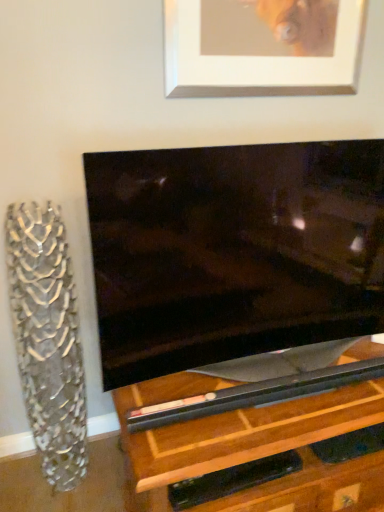
Question: Does silver/metallic picture frame at upper center have a lesser height compared to clear glass vase at left?

Choices:
 (A) yes
 (B) no

Answer: (A)

Question: Does silver/metallic picture frame at upper center have a greater height compared to clear glass vase at left?

Choices:
 (A) no
 (B) yes

Answer: (A)

Question: From the image's perspective, is silver/metallic picture frame at upper center on clear glass vase at left?

Choices:
 (A) yes
 (B) no

Answer: (A)

Question: Does silver/metallic picture frame at upper center have a lesser width compared to clear glass vase at left?

Choices:
 (A) no
 (B) yes

Answer: (B)

Question: Does silver/metallic picture frame at upper center appear on the right side of clear glass vase at left?

Choices:
 (A) no
 (B) yes

Answer: (B)

Question: Is silver/metallic picture frame at upper center looking in the opposite direction of clear glass vase at left?

Choices:
 (A) yes
 (B) no

Answer: (B)

Question: Are clear glass vase at left and silver/metallic picture frame at upper center beside each other?

Choices:
 (A) yes
 (B) no

Answer: (B)

Question: Is clear glass vase at left in front of silver/metallic picture frame at upper center?

Choices:
 (A) no
 (B) yes

Answer: (B)

Question: Is clear glass vase at left aimed at silver/metallic picture frame at upper center?

Choices:
 (A) yes
 (B) no

Answer: (B)

Question: Considering the relative sizes of clear glass vase at left and silver/metallic picture frame at upper center in the image provided, is clear glass vase at left smaller than silver/metallic picture frame at upper center?

Choices:
 (A) no
 (B) yes

Answer: (A)

Question: Is clear glass vase at left wider than silver/metallic picture frame at upper center?

Choices:
 (A) yes
 (B) no

Answer: (A)

Question: From a real-world perspective, is clear glass vase at left positioned over silver/metallic picture frame at upper center based on gravity?

Choices:
 (A) no
 (B) yes

Answer: (A)

Question: Based on their positions, is clear glass vase at left located to the left or right of silver/metallic picture frame at upper center?

Choices:
 (A) left
 (B) right

Answer: (A)